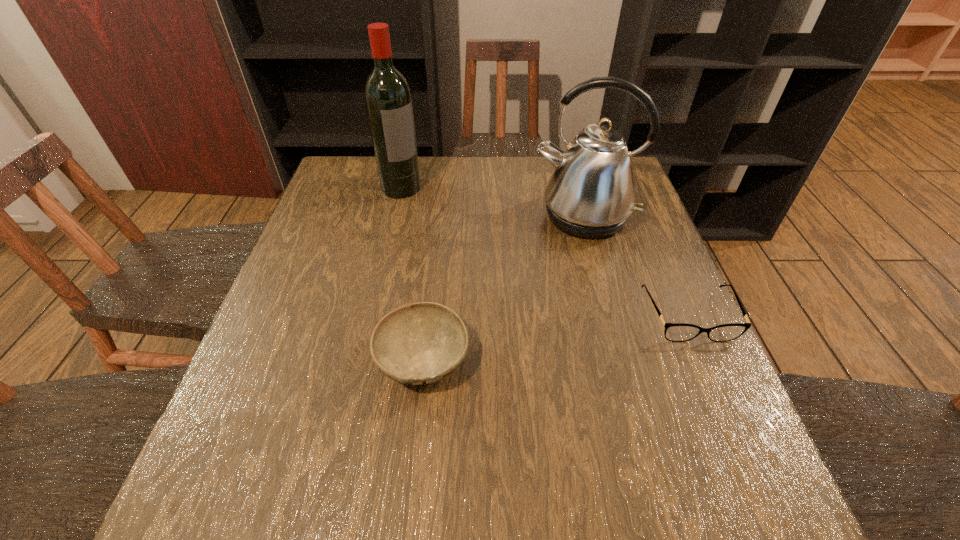
Where is `empty location between the shortest object and the third shortest object`? empty location between the shortest object and the third shortest object is located at coordinates (636, 266).

This screenshot has width=960, height=540. I want to click on unoccupied position between the second shortest object and the spectacles, so click(x=556, y=338).

Where is `free point between the shortest object and the third shortest object`? This screenshot has height=540, width=960. free point between the shortest object and the third shortest object is located at coordinates (636, 266).

I want to click on free space between the kettle and the third tallest object, so click(x=503, y=288).

Locate an element on the screen. This screenshot has width=960, height=540. object that is the second closest to the shortest object is located at coordinates (420, 343).

Identify the location of object that is the third closest one to the second tallest object. The image size is (960, 540). (388, 100).